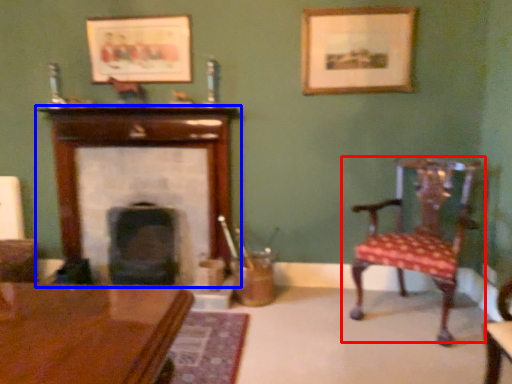
Question: Which point is further to the camera, chair (highlighted by a red box) or fireplace (highlighted by a blue box)?

Choices:
 (A) chair
 (B) fireplace

Answer: (B)